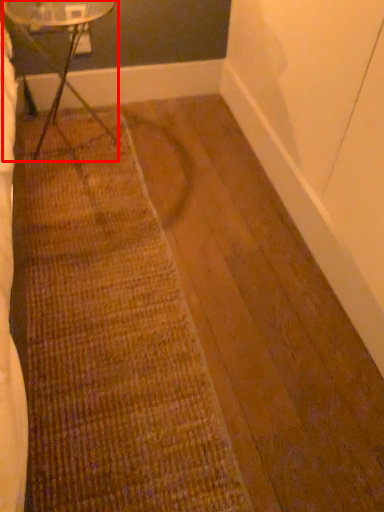
Question: From the image's perspective, what is the correct spatial relationship of table (annotated by the red box) in relation to doormat?

Choices:
 (A) below
 (B) above

Answer: (B)